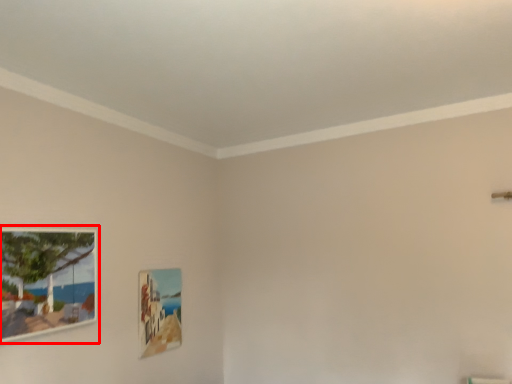
Question: From the image's perspective, where is picture frame (annotated by the red box) located in relation to picture frame in the image?

Choices:
 (A) below
 (B) above

Answer: (B)